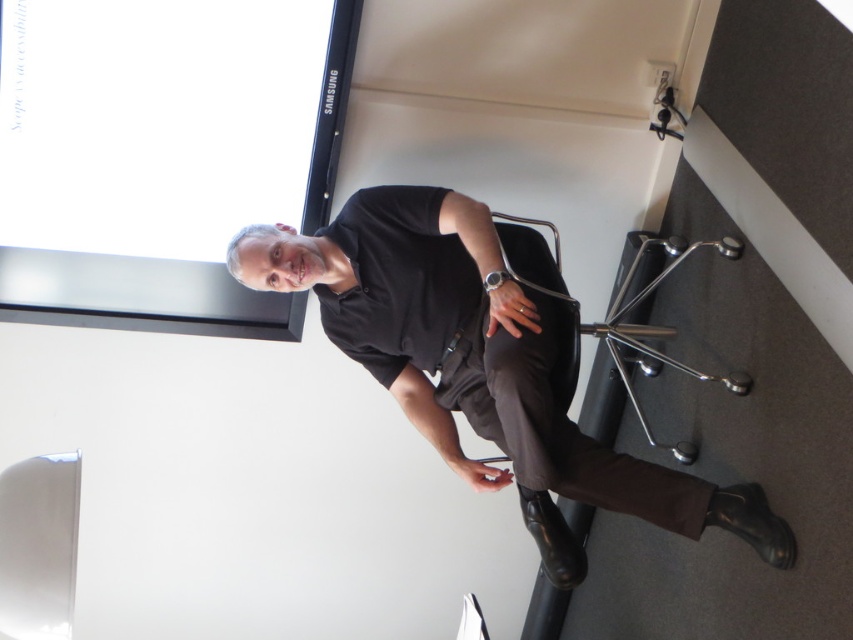
Is black smooth shirt at center in front of metallic silver swivel chair at lower right?

Yes, it is in front of metallic silver swivel chair at lower right.

Is point (454, 312) closer to camera compared to point (660, 243)?

That is True.

Locate an element on the screen. The width and height of the screenshot is (853, 640). black smooth shirt at center is located at coordinates (480, 364).

Does matte black screen at upper center have a smaller size compared to metallic silver swivel chair at lower right?

No, matte black screen at upper center is not smaller than metallic silver swivel chair at lower right.

Who is positioned more to the right, matte black screen at upper center or metallic silver swivel chair at lower right?

metallic silver swivel chair at lower right is more to the right.

At what (x,y) coordinates should I click in order to perform the action: click on matte black screen at upper center. Please return your answer as a coordinate pair (x, y). The width and height of the screenshot is (853, 640). Looking at the image, I should click on (161, 154).

Is matte black screen at upper center closer to the viewer compared to black smooth shirt at center?

No, matte black screen at upper center is behind black smooth shirt at center.

Is matte black screen at upper center taller than black smooth shirt at center?

No.

Does point (263, 214) come farther from viewer compared to point (329, 266)?

Yes.

The height and width of the screenshot is (640, 853). Find the location of `matte black screen at upper center`. matte black screen at upper center is located at coordinates 161,154.